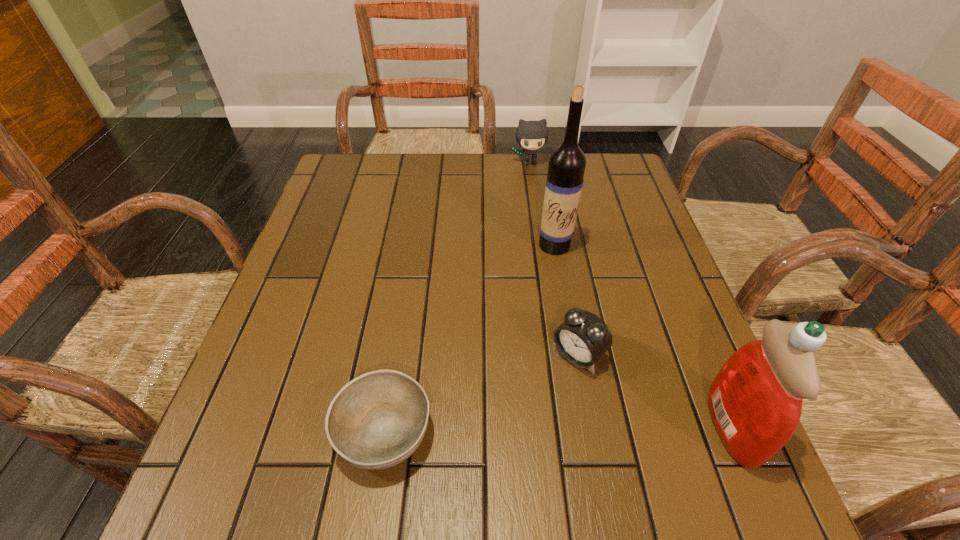
The width and height of the screenshot is (960, 540). In order to click on object that is at the far edge in this screenshot , I will do `click(531, 135)`.

This screenshot has height=540, width=960. I want to click on bowl positioned at the near edge, so click(x=377, y=420).

At what (x,y) coordinates should I click in order to perform the action: click on detergent present at the near edge. Please return your answer as a coordinate pair (x, y). This screenshot has width=960, height=540. Looking at the image, I should click on (755, 401).

This screenshot has height=540, width=960. Identify the location of object that is positioned at the right edge. (755, 401).

The height and width of the screenshot is (540, 960). In order to click on object that is at the near right corner in this screenshot , I will do `click(755, 401)`.

Image resolution: width=960 pixels, height=540 pixels. I want to click on free space at the far edge of the desktop, so click(x=501, y=154).

At what (x,y) coordinates should I click in order to perform the action: click on blank space at the near edge of the desktop. Please return your answer as a coordinate pair (x, y). This screenshot has width=960, height=540. Looking at the image, I should click on (633, 435).

You are a GUI agent. You are given a task and a screenshot of the screen. Output one action in this format:
    pyautogui.click(x=<x>, y=<y>)
    Task: Click on the free space at the left edge of the desktop
    This screenshot has height=540, width=960.
    Given the screenshot: What is the action you would take?
    pyautogui.click(x=274, y=345)

In the image, there is a desktop. Find the location of `blank space at the right edge`. blank space at the right edge is located at coordinates (637, 231).

In the image, there is a desktop. At what (x,y) coordinates should I click in order to perform the action: click on vacant space at the far left corner. Please return your answer as a coordinate pair (x, y). The image size is (960, 540). Looking at the image, I should click on (372, 161).